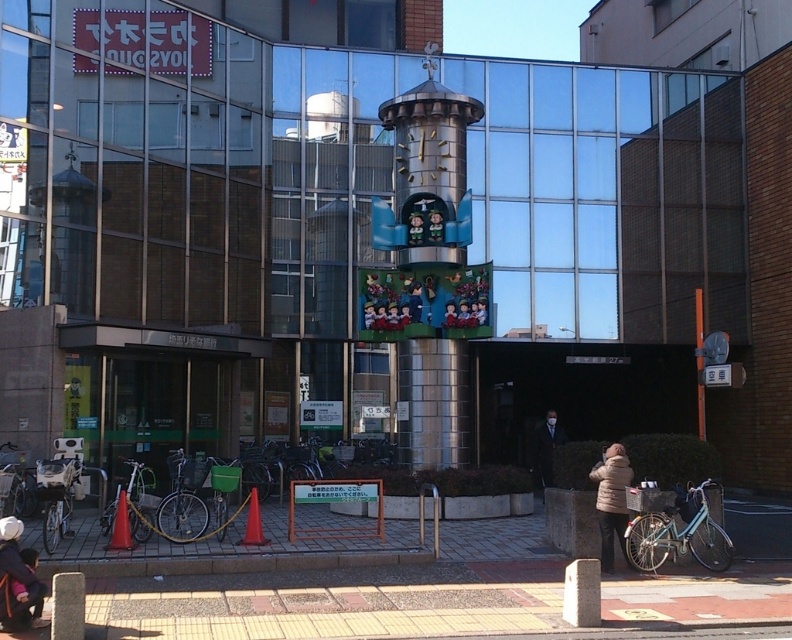
Question: Is the position of brick pavement at lower center more distant than that of dark gray suit at center?

Choices:
 (A) yes
 (B) no

Answer: (B)

Question: Which of the following is the closest to the observer?

Choices:
 (A) white puffy coat at lower right
 (B) polished silver clock tower at center

Answer: (A)

Question: Which of the following is the closest to the observer?

Choices:
 (A) [398, 355]
 (B) [623, 481]

Answer: (B)

Question: Which of the following is the closest to the observer?

Choices:
 (A) tap(545, 433)
 (B) tap(490, 308)

Answer: (B)

Question: Observing the image, what is the correct spatial positioning of matte black jacket at lower left in reference to dark gray suit at center?

Choices:
 (A) right
 (B) left

Answer: (B)

Question: Can you confirm if polished silver clock tower at center is positioned to the right of dark gray suit at center?

Choices:
 (A) no
 (B) yes

Answer: (A)